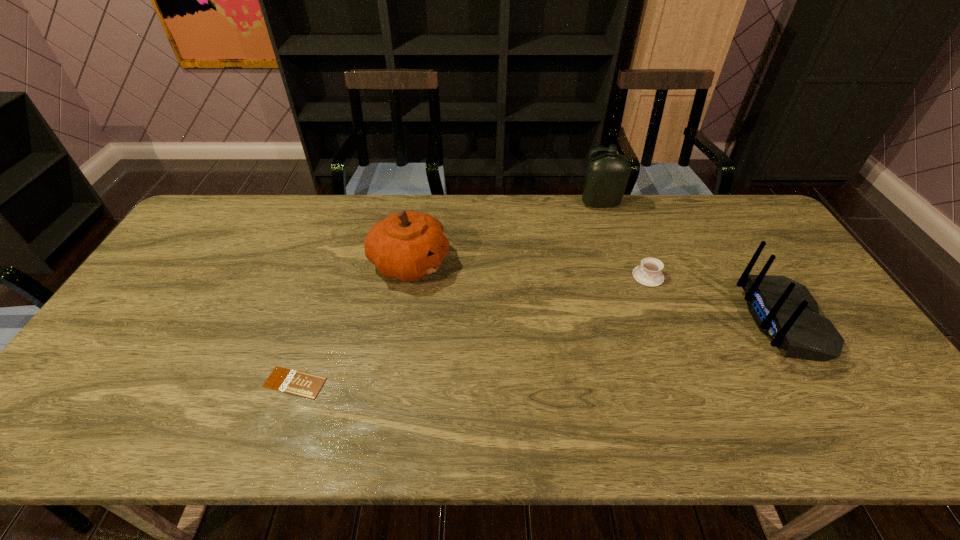
Locate an element on the screen. unoccupied area between the leftmost object and the fourth object from right to left is located at coordinates (352, 323).

Where is `free area in between the chocolate bar and the bottle`? free area in between the chocolate bar and the bottle is located at coordinates (447, 293).

This screenshot has width=960, height=540. I want to click on the fourth closest object to the fourth tallest object, so click(x=294, y=382).

The height and width of the screenshot is (540, 960). I want to click on object that is the second closest to the pumpkin, so click(606, 176).

Identify the location of free space that satisfies the following two spatial constraints: 1. on the back of the rightmost object; 2. on the front side of the leftmost object. (823, 383).